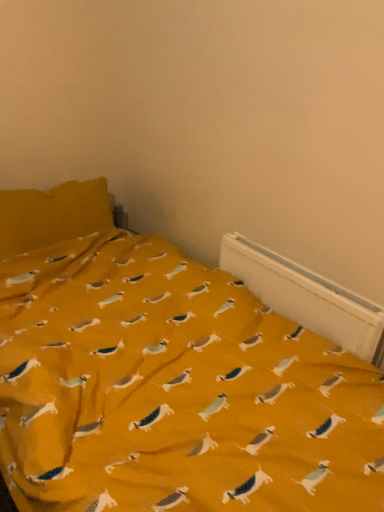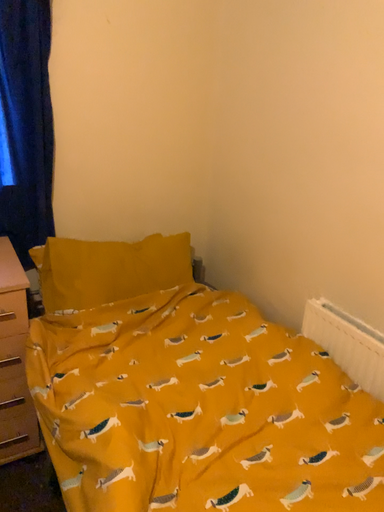
Question: How did the camera likely rotate when shooting the video?

Choices:
 (A) rotated upward
 (B) rotated downward

Answer: (A)